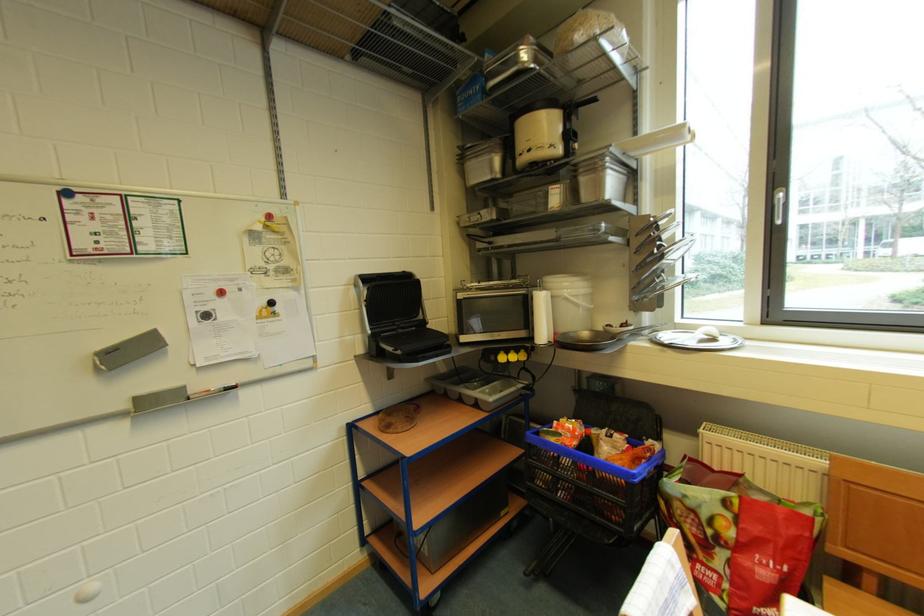
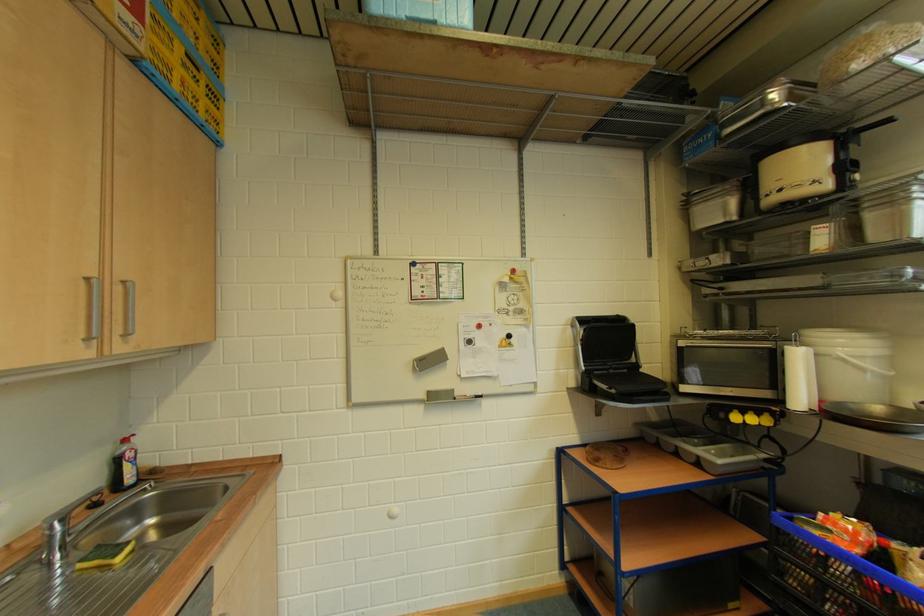
Where in the second image is the point corresponding to point (594, 379) from the first image?

(891, 472)